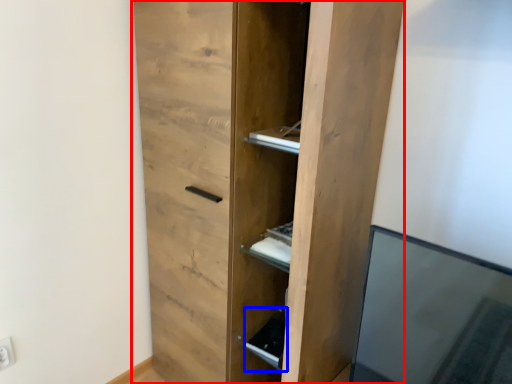
Question: Among these objects, which one is farthest to the camera, cupboard (highlighted by a red box) or cabinet (highlighted by a blue box)?

Choices:
 (A) cupboard
 (B) cabinet

Answer: (B)